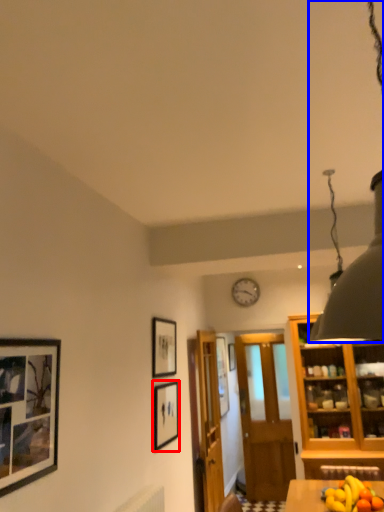
Question: Which point is closer to the camera, picture frame (highlighted by a red box) or light fixture (highlighted by a blue box)?

Choices:
 (A) picture frame
 (B) light fixture

Answer: (B)